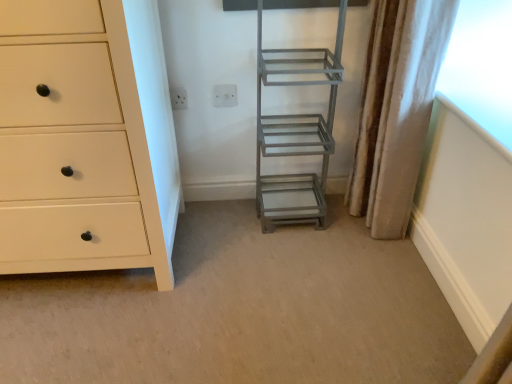
Identify the location of free point in front of silky beige curtain at right. The width and height of the screenshot is (512, 384). (372, 256).